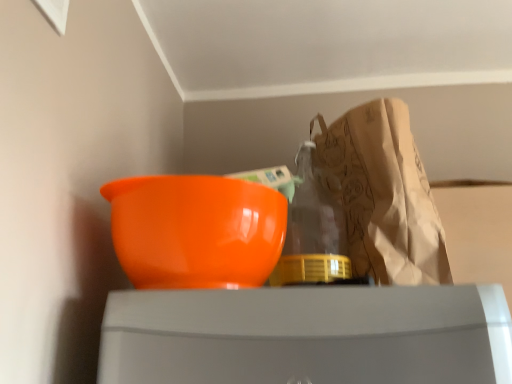
Question: From a real-world perspective, is brown paper grocery bag at upper right positioned over glossy plastic bowl at left based on gravity?

Choices:
 (A) yes
 (B) no

Answer: (A)

Question: Is brown paper grocery bag at upper right further to camera compared to glossy plastic bowl at left?

Choices:
 (A) no
 (B) yes

Answer: (B)

Question: Does brown paper grocery bag at upper right have a smaller size compared to glossy plastic bowl at left?

Choices:
 (A) no
 (B) yes

Answer: (A)

Question: Is brown paper grocery bag at upper right facing away from glossy plastic bowl at left?

Choices:
 (A) yes
 (B) no

Answer: (B)

Question: From a real-world perspective, is brown paper grocery bag at upper right physically below glossy plastic bowl at left?

Choices:
 (A) no
 (B) yes

Answer: (A)

Question: Does brown paper grocery bag at upper right have a larger size compared to glossy plastic bowl at left?

Choices:
 (A) yes
 (B) no

Answer: (A)

Question: From a real-world perspective, is glossy plastic bowl at left beneath brown paper grocery bag at upper right?

Choices:
 (A) yes
 (B) no

Answer: (A)

Question: Is brown paper grocery bag at upper right completely or partially inside glossy plastic bowl at left?

Choices:
 (A) no
 (B) yes

Answer: (A)

Question: Does glossy plastic bowl at left come in front of brown paper grocery bag at upper right?

Choices:
 (A) no
 (B) yes

Answer: (B)

Question: From the image's perspective, would you say glossy plastic bowl at left is shown under brown paper grocery bag at upper right?

Choices:
 (A) no
 (B) yes

Answer: (B)

Question: From the image's perspective, is glossy plastic bowl at left over brown paper grocery bag at upper right?

Choices:
 (A) yes
 (B) no

Answer: (B)

Question: Is glossy plastic bowl at left touching brown paper grocery bag at upper right?

Choices:
 (A) no
 (B) yes

Answer: (A)

Question: In terms of width, does brown paper grocery bag at upper right look wider or thinner when compared to glossy plastic bowl at left?

Choices:
 (A) thin
 (B) wide

Answer: (B)